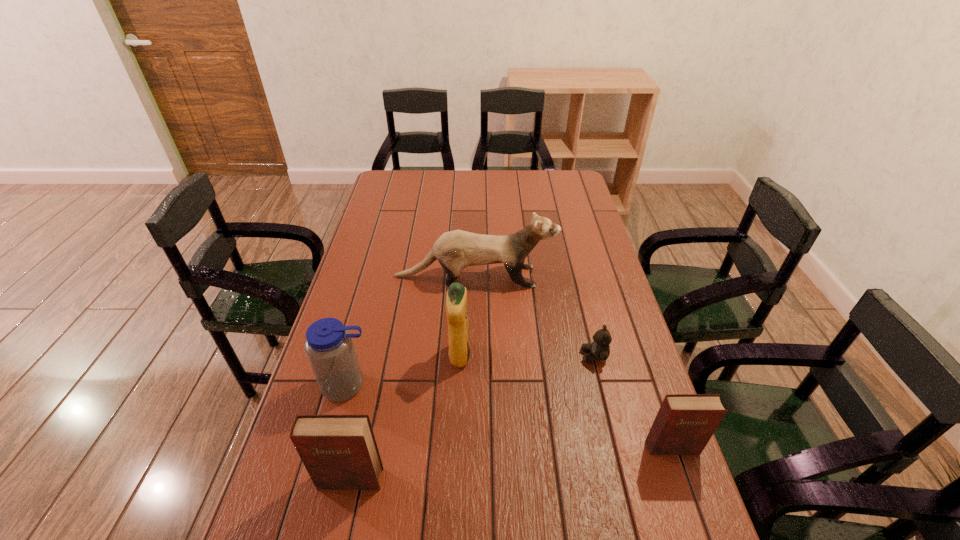
Where is `vacant region that satisfies the following two spatial constraints: 1. on the face of the ferret; 2. on the front cover of the nearest object`? vacant region that satisfies the following two spatial constraints: 1. on the face of the ferret; 2. on the front cover of the nearest object is located at coordinates (472, 480).

This screenshot has width=960, height=540. Identify the location of vacant region that satisfies the following two spatial constraints: 1. on the face of the farthest object; 2. on the front cover of the left diary. (472, 480).

Image resolution: width=960 pixels, height=540 pixels. Identify the location of vacant area in the image that satisfies the following two spatial constraints: 1. on the label of the detergent; 2. on the front cover of the left diary. (454, 480).